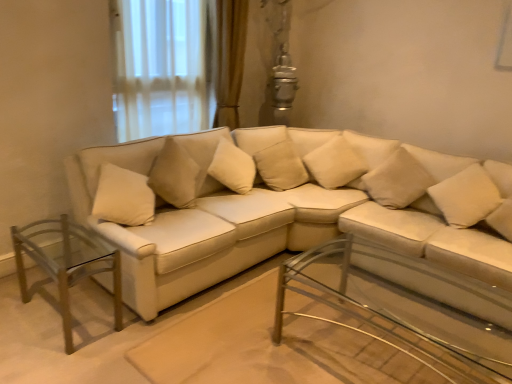
Question: Considering the relative sizes of clear glass coffee table at center, the first table in the right-to-left sequence, and clear glass table at left, which is counted as the second table, starting from the right, in the image provided, is clear glass coffee table at center, the first table in the right-to-left sequence, thinner than clear glass table at left, which is counted as the second table, starting from the right,?

Choices:
 (A) yes
 (B) no

Answer: (A)

Question: Is clear glass coffee table at center, the first table in the right-to-left sequence, not inside clear glass table at left, which is counted as the second table, starting from the right?

Choices:
 (A) no
 (B) yes

Answer: (B)

Question: From a real-world perspective, is clear glass coffee table at center, the first table in the right-to-left sequence, beneath clear glass table at left, which is the first table from left to right?

Choices:
 (A) no
 (B) yes

Answer: (A)

Question: Is clear glass coffee table at center, which appears as the second table when viewed from the left, wider than clear glass table at left, which is the first table from left to right?

Choices:
 (A) no
 (B) yes

Answer: (A)

Question: Is clear glass coffee table at center, which appears as the second table when viewed from the left, at the right side of clear glass table at left, which is the first table from left to right?

Choices:
 (A) yes
 (B) no

Answer: (A)

Question: Does beige fabric pillow at upper right, which ranks as the 2th pillow in right-to-left order, turn towards beige fabric pillow at right, which is the fourth pillow from left to right?

Choices:
 (A) no
 (B) yes

Answer: (A)

Question: Is beige fabric pillow at upper right, which is the 3th pillow from left to right, smaller than beige fabric pillow at right, which is the 1th pillow from right to left?

Choices:
 (A) yes
 (B) no

Answer: (B)

Question: Is the depth of beige fabric pillow at upper right, which ranks as the 2th pillow in right-to-left order, less than that of beige fabric pillow at right, which is the fourth pillow from left to right?

Choices:
 (A) yes
 (B) no

Answer: (B)

Question: Does beige fabric pillow at upper right, which is the 3th pillow from left to right, have a greater width compared to beige fabric pillow at right, which is the 1th pillow from right to left?

Choices:
 (A) yes
 (B) no

Answer: (A)

Question: Does beige fabric pillow at upper right, which ranks as the 2th pillow in right-to-left order, have a lesser width compared to beige fabric pillow at right, which is the 1th pillow from right to left?

Choices:
 (A) no
 (B) yes

Answer: (A)

Question: Considering the relative positions of beige fabric pillow at upper right, which is the 3th pillow from left to right, and beige fabric pillow at right, which is the 1th pillow from right to left, in the image provided, is beige fabric pillow at upper right, which is the 3th pillow from left to right, to the right of beige fabric pillow at right, which is the 1th pillow from right to left, from the viewer's perspective?

Choices:
 (A) no
 (B) yes

Answer: (A)

Question: Would you say clear glass table at left, which is counted as the second table, starting from the right, contains beige fabric pillow at center, placed as the fourth pillow when sorted from right to left?

Choices:
 (A) yes
 (B) no

Answer: (B)